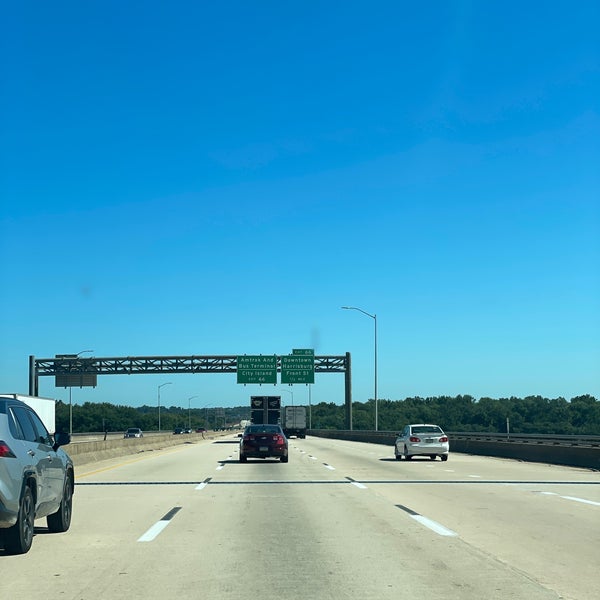
You are a GUI agent. You are given a task and a screenshot of the screen. Output one action in this format:
    pyautogui.click(x=<x>, y=<y>)
    Task: Click on the light
    
    Given the screenshot: What is the action you would take?
    pyautogui.click(x=169, y=382)